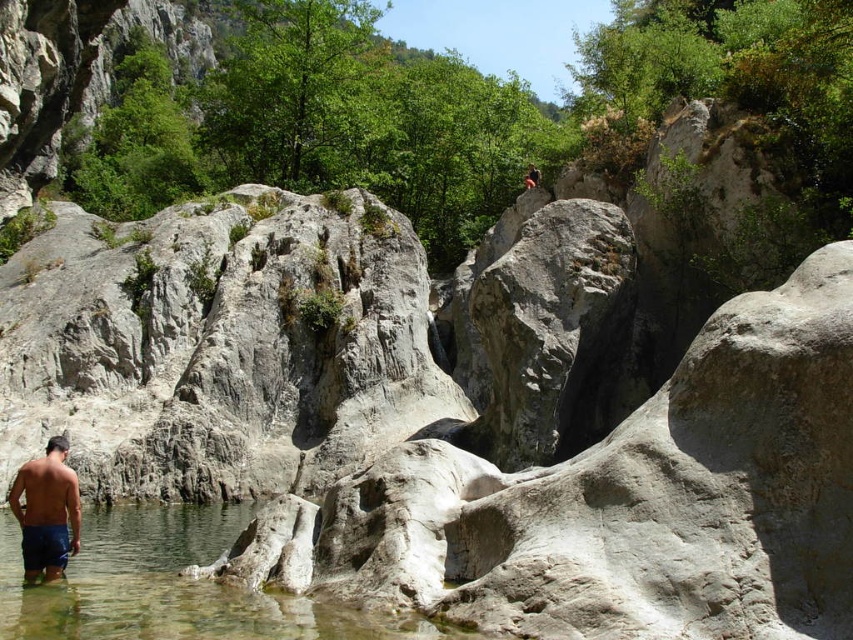
Question: Can you confirm if clear water at lower left is smaller than blue denim shorts at lower left?

Choices:
 (A) no
 (B) yes

Answer: (A)

Question: Can you confirm if clear water at lower left is positioned to the left of blue denim shorts at lower left?

Choices:
 (A) no
 (B) yes

Answer: (A)

Question: Among these objects, which one is nearest to the camera?

Choices:
 (A) clear water at lower left
 (B) blue denim shorts at lower left

Answer: (A)

Question: Is clear water at lower left to the right of blue denim shorts at lower left from the viewer's perspective?

Choices:
 (A) no
 (B) yes

Answer: (B)